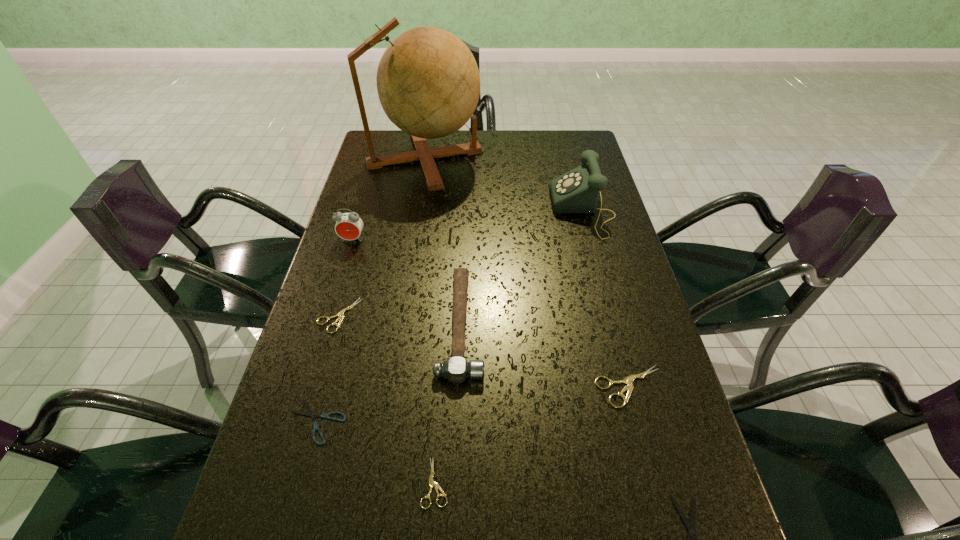
You are a GUI agent. You are given a task and a screenshot of the screen. Output one action in this format:
    pyautogui.click(x=<x>, y=<y>)
    Task: Click on the fourth closest shears to the right black shears
    This screenshot has width=960, height=540.
    Given the screenshot: What is the action you would take?
    pyautogui.click(x=340, y=315)

This screenshot has height=540, width=960. I want to click on beige shears that is the nearest to the nearer black shears, so click(628, 380).

Locate an element on the screen. the closest beige shears to the biggest beige shears is located at coordinates (432, 484).

You are a GUI agent. You are given a task and a screenshot of the screen. Output one action in this format:
    pyautogui.click(x=<x>, y=<y>)
    Task: Click on the black shears that is the second closest to the farthest shears
    The height and width of the screenshot is (540, 960).
    Given the screenshot: What is the action you would take?
    pyautogui.click(x=690, y=526)

What are the coordinates of `free space that satisfies the following two spatial constraints: 1. on the dial of the telephone; 2. on the face of the red alarm clock` in the screenshot? It's located at (590, 240).

The width and height of the screenshot is (960, 540). I want to click on vacant space that satisfies the following two spatial constraints: 1. on the surface of the tallest object; 2. on the face of the red alarm clock, so click(x=412, y=240).